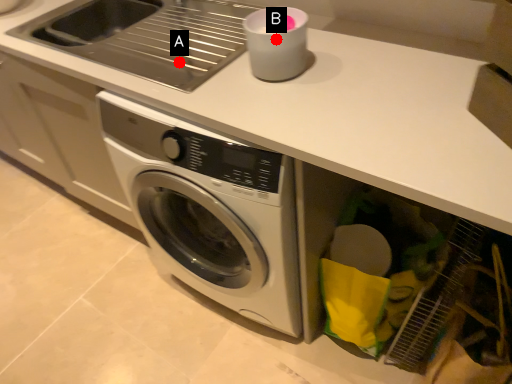
Question: Two points are circled on the image, labeled by A and B beside each circle. Among these points, which one is nearest to the camera?

Choices:
 (A) A is closer
 (B) B is closer

Answer: (B)